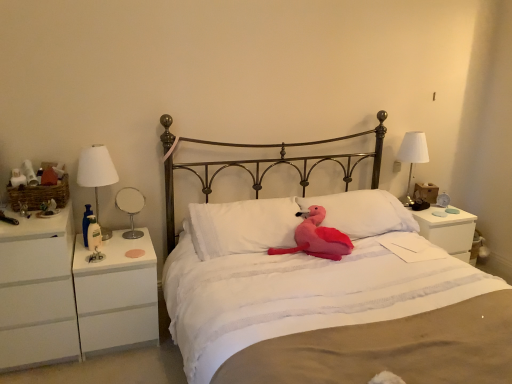
Image resolution: width=512 pixels, height=384 pixels. In order to click on white soft pillow at center, the 1th pillow in the right-to-left sequence in this screenshot , I will do `click(362, 212)`.

This screenshot has height=384, width=512. Describe the element at coordinates (116, 294) in the screenshot. I see `white plastic nightstand at left, the 2th nightstand in the left-to-right sequence` at that location.

What do you see at coordinates (37, 291) in the screenshot? I see `white glossy nightstand at left, the 1th nightstand positioned from the left` at bounding box center [37, 291].

You are a GUI agent. You are given a task and a screenshot of the screen. Output one action in this format:
    pyautogui.click(x=<x>, y=<y>)
    Task: Click on the white fabric lampshade at right, which is the second bedside lamp in left-to-right order
    The height and width of the screenshot is (384, 512).
    Given the screenshot: What is the action you would take?
    pyautogui.click(x=413, y=154)

This screenshot has height=384, width=512. What do you see at coordinates (413, 154) in the screenshot?
I see `white fabric lampshade at right, which appears as the first bedside lamp when viewed from the right` at bounding box center [413, 154].

Where is `white soft pillow at center, acting as the second pillow starting from the right`? white soft pillow at center, acting as the second pillow starting from the right is located at coordinates pyautogui.click(x=243, y=226).

Image resolution: width=512 pixels, height=384 pixels. What do you see at coordinates (328, 296) in the screenshot?
I see `pink plush toy at center` at bounding box center [328, 296].

You are a GUI agent. You are given a task and a screenshot of the screen. Output one action in this format:
    pyautogui.click(x=<x>, y=<y>)
    Task: Click on the white fabric lampshade at left, which is the 1th bedside lamp from front to back
    
    Given the screenshot: What is the action you would take?
    pyautogui.click(x=96, y=170)

In the scene shown: Can you see white plastic nightstand at left, which ranks as the second nightstand in right-to-left order, touching white fabric lampshade at right, placed as the 1th bedside lamp when sorted from back to front?

No, white plastic nightstand at left, which ranks as the second nightstand in right-to-left order, is not making contact with white fabric lampshade at right, placed as the 1th bedside lamp when sorted from back to front.

Do you think white plastic nightstand at left, the 2th nightstand in the left-to-right sequence, is within white fabric lampshade at right, which is the second bedside lamp in left-to-right order, or outside of it?

white plastic nightstand at left, the 2th nightstand in the left-to-right sequence, is located beyond the bounds of white fabric lampshade at right, which is the second bedside lamp in left-to-right order.

Is white plastic nightstand at left, the 2th nightstand in the left-to-right sequence, facing away from white fabric lampshade at right, placed as the 1th bedside lamp when sorted from back to front?

No, white plastic nightstand at left, the 2th nightstand in the left-to-right sequence, is not facing away from white fabric lampshade at right, placed as the 1th bedside lamp when sorted from back to front.

From a real-world perspective, is white plastic nightstand at left, which ranks as the second nightstand in right-to-left order, positioned above or below white fabric lampshade at right, placed as the 1th bedside lamp when sorted from back to front?

From a real-world perspective, white plastic nightstand at left, which ranks as the second nightstand in right-to-left order, is physically below white fabric lampshade at right, placed as the 1th bedside lamp when sorted from back to front.

Considering the sizes of objects white glossy nightstand at left, acting as the third nightstand starting from the right, and white soft pillow at center, the 1th pillow in the right-to-left sequence, in the image provided, who is thinner, white glossy nightstand at left, acting as the third nightstand starting from the right, or white soft pillow at center, the 1th pillow in the right-to-left sequence,?

With smaller width is white soft pillow at center, the 1th pillow in the right-to-left sequence.

Is the depth of white glossy nightstand at left, the 1th nightstand positioned from the left, less than that of white soft pillow at center, the 1th pillow in the right-to-left sequence?

Result: That is True.

What's the angular difference between white glossy nightstand at left, acting as the third nightstand starting from the right, and white soft pillow at center, the 1th pillow in the right-to-left sequence,'s facing directions?

There is a 3.6-degree angle between the facing directions of white glossy nightstand at left, acting as the third nightstand starting from the right, and white soft pillow at center, the 1th pillow in the right-to-left sequence.

Considering the points (59, 321) and (360, 215), which point is behind, point (59, 321) or point (360, 215)?

The point (360, 215) is farther.

From a real-world perspective, which is physically above, white matte nightstand at right, acting as the 3th nightstand starting from the left, or fluffy pink plush at center?

In real-world perspective, fluffy pink plush at center is above.

The height and width of the screenshot is (384, 512). I want to click on animal above the white matte nightstand at right, acting as the 3th nightstand starting from the left (from a real-world perspective), so click(x=317, y=237).

Does white matte nightstand at right, the 1th nightstand positioned from the right, have a greater width compared to fluffy pink plush at center?

Correct, the width of white matte nightstand at right, the 1th nightstand positioned from the right, exceeds that of fluffy pink plush at center.

Is white matte nightstand at right, acting as the 3th nightstand starting from the left, a part of white glossy nightstand at left, acting as the third nightstand starting from the right?

No.

How different are the orientations of white glossy nightstand at left, the 1th nightstand positioned from the left, and white matte nightstand at right, acting as the 3th nightstand starting from the left, in degrees?

0.882 degrees separate the facing orientations of white glossy nightstand at left, the 1th nightstand positioned from the left, and white matte nightstand at right, acting as the 3th nightstand starting from the left.

From their relative heights in the image, would you say white glossy nightstand at left, the 1th nightstand positioned from the left, is taller or shorter than white matte nightstand at right, the 1th nightstand positioned from the right?

Clearly, white glossy nightstand at left, the 1th nightstand positioned from the left, is taller compared to white matte nightstand at right, the 1th nightstand positioned from the right.

Is fluffy pink plush at center a part of white fabric lampshade at right, which is the second bedside lamp in left-to-right order?

No.

From a real-world perspective, which is physically below, white fabric lampshade at right, which appears as the first bedside lamp when viewed from the right, or fluffy pink plush at center?

In real-world perspective, fluffy pink plush at center is lower.

Which of these two, white fabric lampshade at right, which is the second bedside lamp in left-to-right order, or fluffy pink plush at center, is bigger?

With larger size is fluffy pink plush at center.

Is white fabric lampshade at right, which is the second bedside lamp in left-to-right order, at the left side of fluffy pink plush at center?

Incorrect, white fabric lampshade at right, which is the second bedside lamp in left-to-right order, is not on the left side of fluffy pink plush at center.

Find the location of `the 2nd pillow behind the fluffy pink plush at center, counting from the anchor's position`. the 2nd pillow behind the fluffy pink plush at center, counting from the anchor's position is located at coordinates (362, 212).

How different are the orientations of fluffy pink plush at center and white soft pillow at center, positioned as the second pillow in left-to-right order, in degrees?

They differ by 4.78 degrees in their facing directions.

From a real-world perspective, which is physically below, fluffy pink plush at center or white soft pillow at center, the 1th pillow in the right-to-left sequence?

From a 3D spatial view, fluffy pink plush at center is below.

Considering the points (327, 231) and (330, 219), which point is behind, point (327, 231) or point (330, 219)?

Positioned behind is point (330, 219).

Could you measure the distance between white soft pillow at center, arranged as the first pillow when viewed from the left, and white plastic nightstand at left, which ranks as the second nightstand in right-to-left order?

white soft pillow at center, arranged as the first pillow when viewed from the left, and white plastic nightstand at left, which ranks as the second nightstand in right-to-left order, are 20.25 inches apart from each other.

Does white soft pillow at center, acting as the second pillow starting from the right, have a larger size compared to white plastic nightstand at left, which ranks as the second nightstand in right-to-left order?

No, white soft pillow at center, acting as the second pillow starting from the right, is not bigger than white plastic nightstand at left, which ranks as the second nightstand in right-to-left order.

There is a white plastic nightstand at left, the 2th nightstand in the left-to-right sequence. Where is `the 1st pillow above it (from the image's perspective)`? the 1st pillow above it (from the image's perspective) is located at coordinates (243, 226).

From the image's perspective, which object appears higher, white soft pillow at center, arranged as the first pillow when viewed from the left, or white plastic nightstand at left, the 2th nightstand in the left-to-right sequence?

white soft pillow at center, arranged as the first pillow when viewed from the left.

I want to click on the 2nd bedside lamp behind the white plastic nightstand at left, the 2th nightstand in the left-to-right sequence, so click(x=413, y=154).

Where is `the 2nd nightstand in front of the white soft pillow at center, positioned as the second pillow in left-to-right order`? Image resolution: width=512 pixels, height=384 pixels. the 2nd nightstand in front of the white soft pillow at center, positioned as the second pillow in left-to-right order is located at coordinates (37, 291).

When comparing their distances from white glossy table lamp at left, does white matte nightstand at right, the 1th nightstand positioned from the right, or pink plush toy at center seem closer?

pink plush toy at center.

When comparing their distances from pink plush toy at center, does white matte nightstand at right, acting as the 3th nightstand starting from the left, or white soft pillow at center, positioned as the second pillow in left-to-right order, seem closer?

Based on the image, white soft pillow at center, positioned as the second pillow in left-to-right order, appears to be nearer to pink plush toy at center.

Consider the image. Looking at the image, which one is located closer to white soft pillow at center, the 1th pillow in the right-to-left sequence, white glossy nightstand at left, the 1th nightstand positioned from the left, or white glossy table lamp at left?

Among the two, white glossy table lamp at left is located nearer to white soft pillow at center, the 1th pillow in the right-to-left sequence.

Based on their spatial positions, is white fabric lampshade at left, the second bedside lamp viewed from the right, or white plastic nightstand at left, the 2th nightstand in the left-to-right sequence, closer to white glossy nightstand at left, the 1th nightstand positioned from the left?

Based on the image, white plastic nightstand at left, the 2th nightstand in the left-to-right sequence, appears to be nearer to white glossy nightstand at left, the 1th nightstand positioned from the left.

From the image, which object appears to be nearer to pink plush toy at center, white fabric lampshade at left, placed as the 2th bedside lamp when sorted from back to front, or white matte nightstand at right, acting as the 3th nightstand starting from the left?

white matte nightstand at right, acting as the 3th nightstand starting from the left.

Considering their positions, is white fabric lampshade at right, placed as the 1th bedside lamp when sorted from back to front, positioned further to white glossy table lamp at left than white fabric lampshade at left, placed as the 2th bedside lamp when sorted from back to front?

white fabric lampshade at right, placed as the 1th bedside lamp when sorted from back to front.

Estimate the real-world distances between objects in this image. Which object is closer to white fabric lampshade at left, positioned as the 1th bedside lamp in left-to-right order, fluffy pink plush at center or white soft pillow at center, acting as the second pillow starting from the right?

white soft pillow at center, acting as the second pillow starting from the right, lies closer to white fabric lampshade at left, positioned as the 1th bedside lamp in left-to-right order, than the other object.

Estimate the real-world distances between objects in this image. Which object is further from pink plush toy at center, white plastic nightstand at left, the 2th nightstand in the left-to-right sequence, or white glossy table lamp at left?

Among the two, white glossy table lamp at left is located further to pink plush toy at center.

Identify the location of animal located between pink plush toy at center and white fabric lampshade at left, the second bedside lamp viewed from the right, in the depth direction. (317, 237).

You are a GUI agent. You are given a task and a screenshot of the screen. Output one action in this format:
    pyautogui.click(x=<x>, y=<y>)
    Task: Click on the animal situated between white fabric lampshade at left, the second bedside lamp viewed from the right, and white soft pillow at center, the 1th pillow in the right-to-left sequence, from left to right
    The width and height of the screenshot is (512, 384).
    Given the screenshot: What is the action you would take?
    pyautogui.click(x=317, y=237)

The width and height of the screenshot is (512, 384). I want to click on nightstand situated between white fabric lampshade at left, positioned as the 1th bedside lamp in left-to-right order, and white matte nightstand at right, the 1th nightstand positioned from the right, from left to right, so click(x=116, y=294).

The width and height of the screenshot is (512, 384). In order to click on bedside lamp between white fabric lampshade at left, placed as the 2th bedside lamp when sorted from back to front, and white matte nightstand at right, the 1th nightstand positioned from the right, from left to right in this screenshot , I will do `click(413, 154)`.